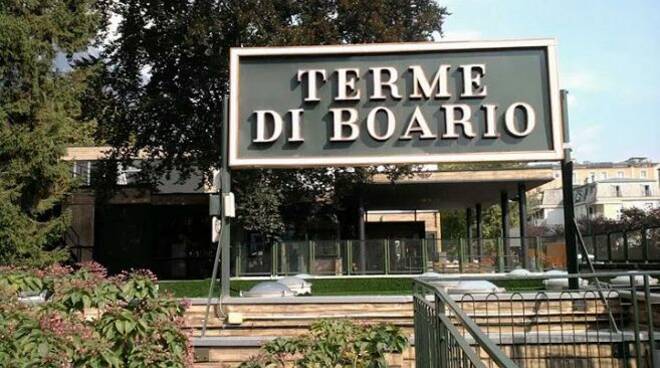
Find the location of a particular element. The width and height of the screenshot is (660, 368). hand rail is located at coordinates (490, 348), (620, 273).